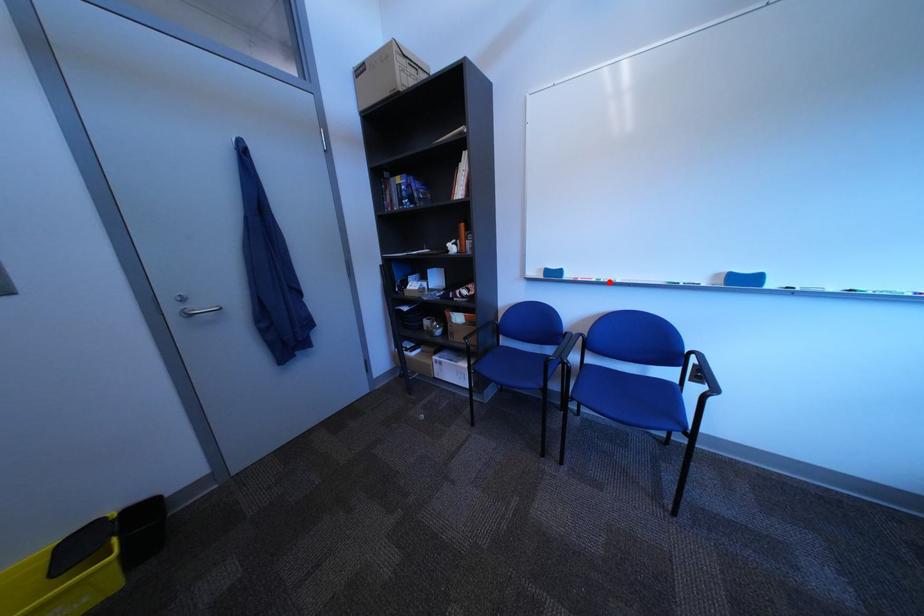
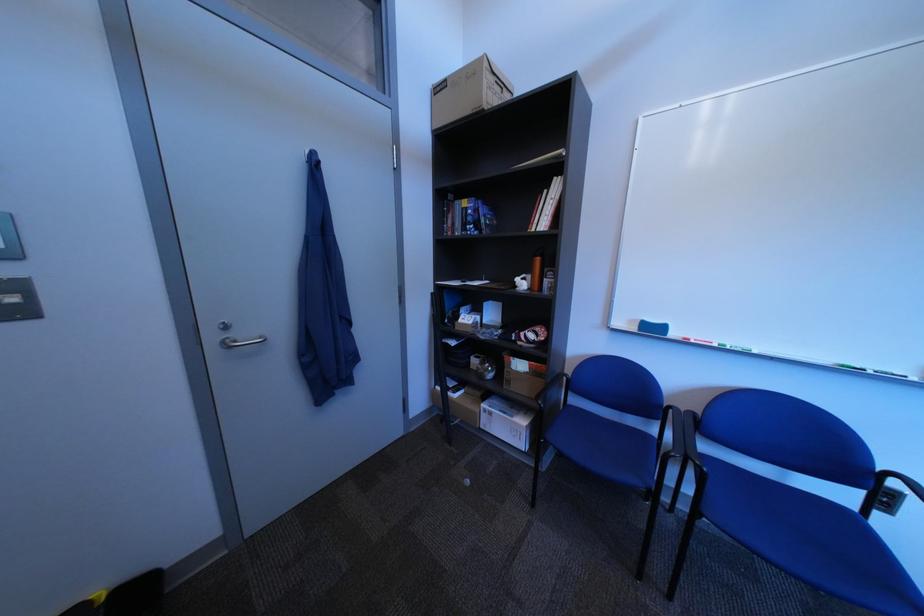
Find the pixel in the second image that matches the highlighted location in the first image.

(732, 347)